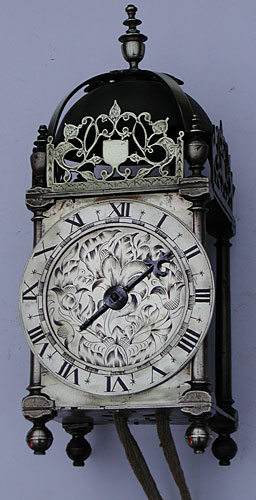
Find the location of a particular element. decorative ornament at clock top is located at coordinates (130, 43).